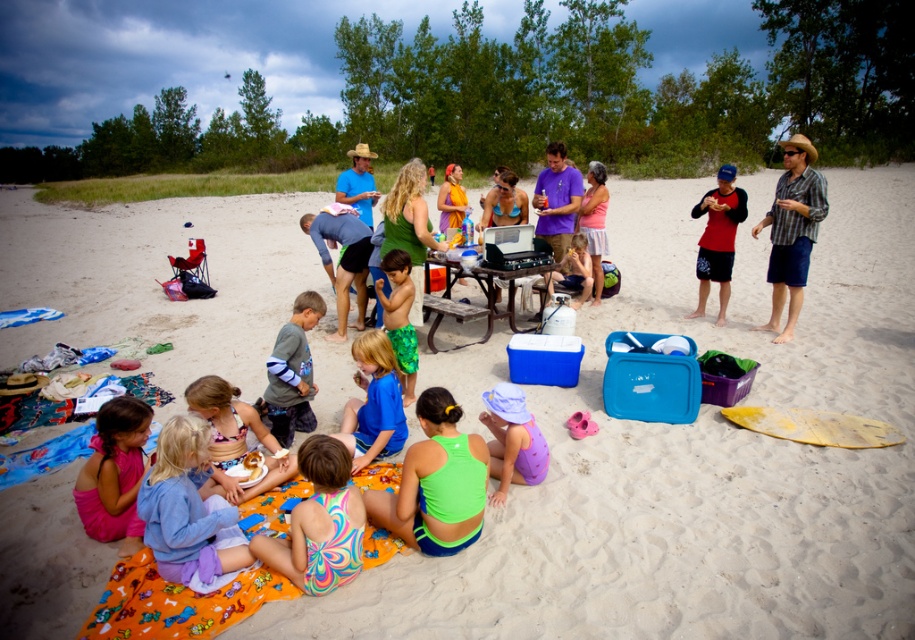
You are a photographer standing at the edge of the beach. You want to take a photo that includes both the multicolored swimsuit at center and the blue swim trunks at center. Which one should you focus on first to ensure both are in sharp focus?

You should focus on the multicolored swimsuit at center first because it is closer to you than the blue swim trunks at center. By focusing on the closer object, the farther one will still be in focus due to the depth of field.

You are standing on the beach and see two points marked in the image. Which point is closer to you, point (307, 228) or point (413, 369)?

Point (307, 228) is closer to you than point (413, 369).

You are a photographer trying to capture a candid shot of the blue swim trunks at center and the green textured shorts at center. Since you want to ensure both are visible in the frame, which object should you position closer to the camera to avoid cropping?

The blue swim trunks at center are wider than the green textured shorts at center. To ensure both fit in the frame, position the blue swim trunks at center closer to the camera since its larger size requires more space in the photo.